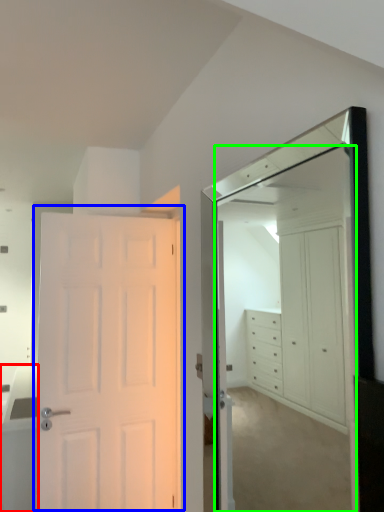
Question: Estimate the real-world distances between objects in this image. Which object is closer to cabinetry (highlighted by a red box), door (highlighted by a blue box) or mirror (highlighted by a green box)?

Choices:
 (A) door
 (B) mirror

Answer: (A)